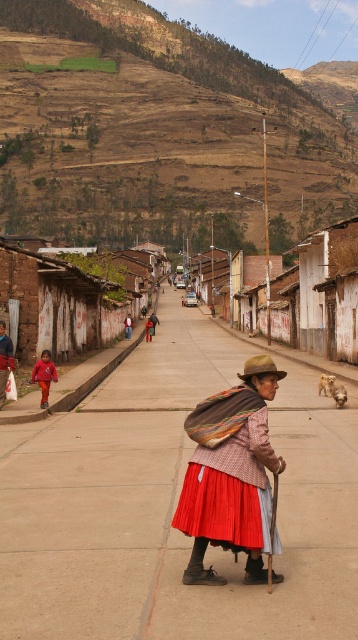
Question: Which point appears farthest from the camera in this image?

Choices:
 (A) (187, 99)
 (B) (287, 408)
 (C) (254, 506)
 (D) (146, 326)

Answer: (A)

Question: Which object appears farthest from the camera in this image?

Choices:
 (A) red fabric skirt at lower left
 (B) smooth concrete pavement at center
 (C) matte red sweater at left
 (D) red plaid shawl at center

Answer: (C)

Question: Does brown earthy hillside at upper center have a greater width compared to red fabric skirt at lower left?

Choices:
 (A) no
 (B) yes

Answer: (B)

Question: Is red fabric jacket at center positioned behind red fabric shawl at center?

Choices:
 (A) yes
 (B) no

Answer: (A)

Question: Is brown earthy hillside at upper center below red fabric jacket at center?

Choices:
 (A) yes
 (B) no

Answer: (B)

Question: Which point is farther to the camera?

Choices:
 (A) red fabric skirt at lower left
 (B) matte red sweater at left
 (C) brown earthy hillside at upper center
 (D) red fabric shawl at center

Answer: (C)